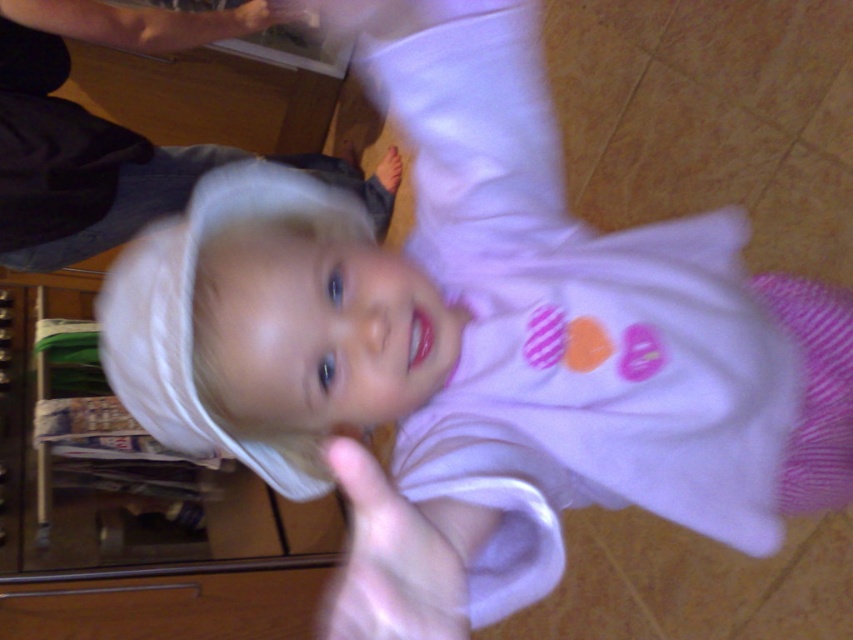
Question: Does white fabric at upper center appear on the right side of pink fabric hand at center?

Choices:
 (A) yes
 (B) no

Answer: (B)

Question: Among these objects, which one is farthest from the camera?

Choices:
 (A) smooth skin hand at upper center
 (B) pink fabric hand at center
 (C) white fabric at upper center

Answer: (A)

Question: Does pink fabric hand at center have a lesser width compared to smooth skin hand at upper center?

Choices:
 (A) no
 (B) yes

Answer: (B)

Question: Considering the real-world distances, which object is closest to the pink fabric hand at center?

Choices:
 (A) smooth skin hand at upper center
 (B) white fabric at upper center

Answer: (B)

Question: Which point appears farthest from the camera in this image?

Choices:
 (A) (281, 16)
 (B) (0, 81)

Answer: (A)

Question: Can you confirm if pink fabric hand at center is bigger than smooth skin hand at upper center?

Choices:
 (A) yes
 (B) no

Answer: (B)